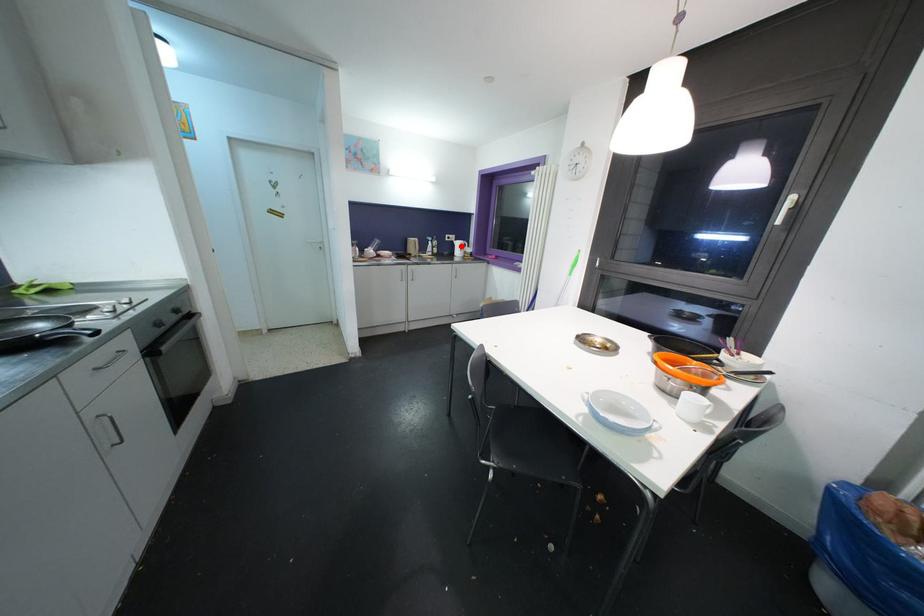
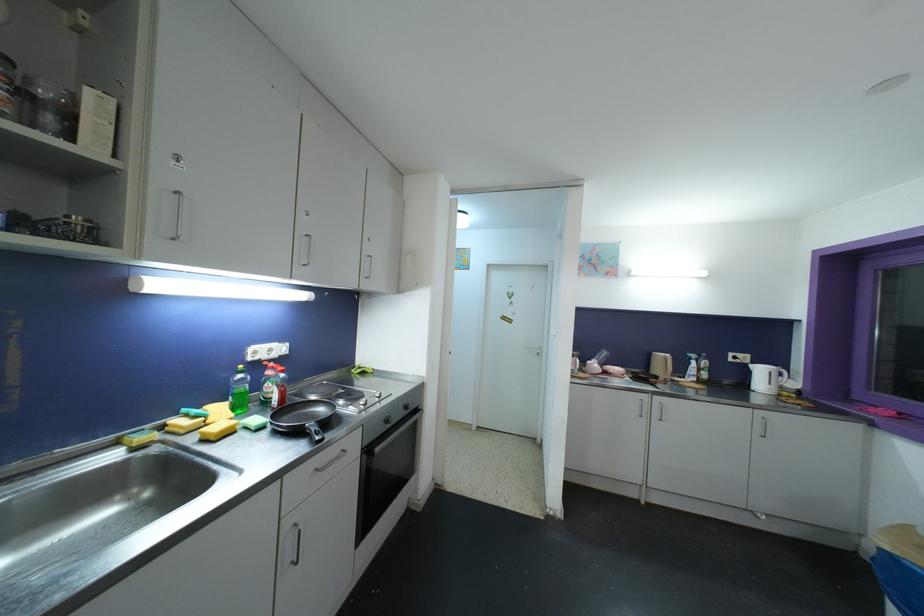
Question: I am providing you with two images of the same scene from different viewpoints. Given a red point in image1, look at the same physical point in image2. Is it:

Choices:
 (A) Closer to the viewpoint
 (B) Farther from the viewpoint

Answer: (B)